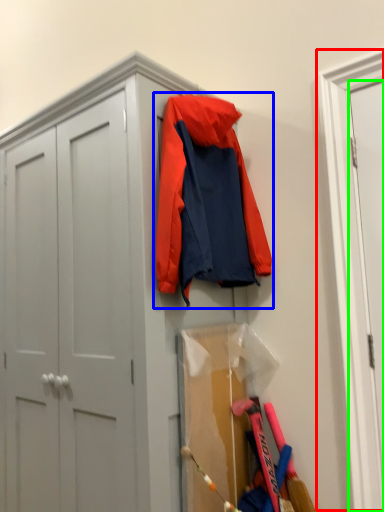
Question: Based on their relative distances, which object is farther from door (highlighted by a red box)? Choose from jacket (highlighted by a blue box) and door (highlighted by a green box).

Choices:
 (A) jacket
 (B) door

Answer: (A)